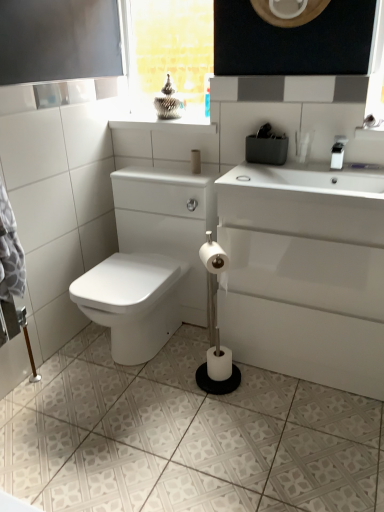
The width and height of the screenshot is (384, 512). I want to click on vacant space behind white matte soap at upper right, so click(245, 172).